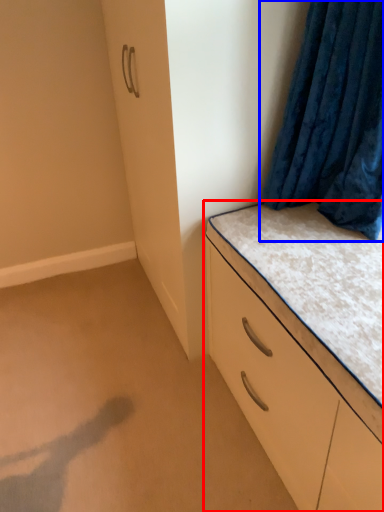
Question: Which of the following is the farthest to the observer, chest of drawers (highlighted by a red box) or curtain (highlighted by a blue box)?

Choices:
 (A) chest of drawers
 (B) curtain

Answer: (B)